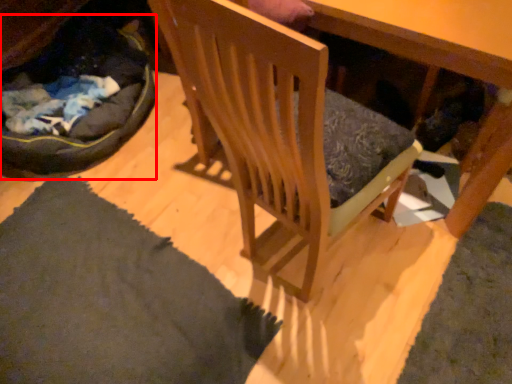
Question: In this image, where is cat bed (annotated by the red box) located relative to chair?

Choices:
 (A) right
 (B) left

Answer: (B)